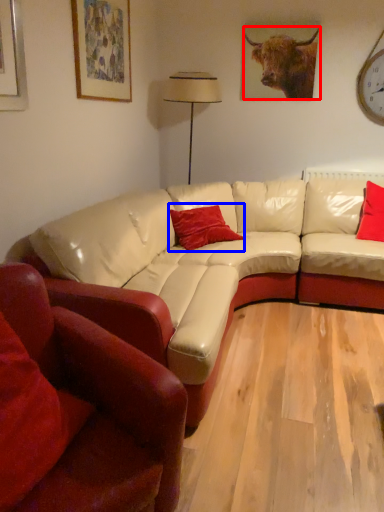
Question: Which object is closer to the camera taking this photo, bull (highlighted by a red box) or pillow (highlighted by a blue box)?

Choices:
 (A) bull
 (B) pillow

Answer: (B)